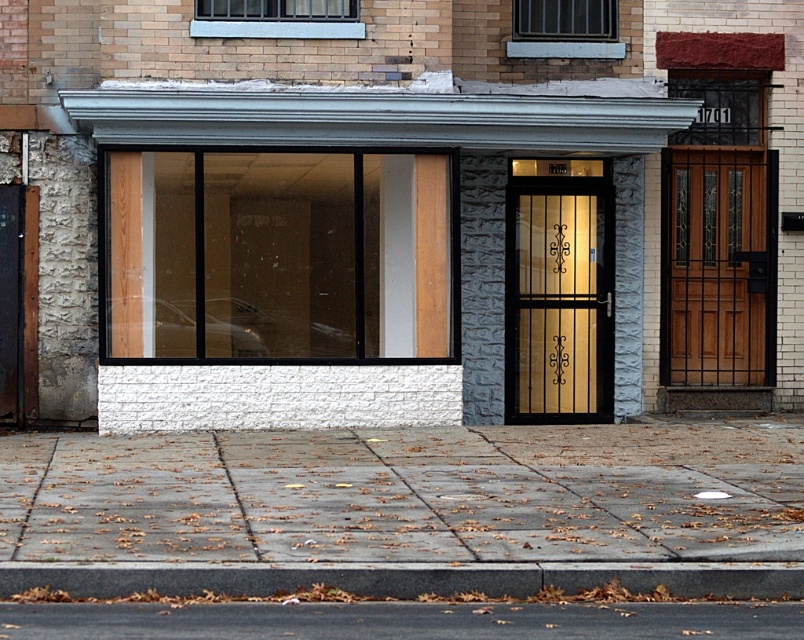
Question: Which object appears closest to the camera in this image?

Choices:
 (A) gray concrete pavement at lower center
 (B) white brick wall at center
 (C) mahogany wood door at right
 (D) gold textured glass door at center

Answer: (A)

Question: Which object is positioned farthest from the white brick wall at center?

Choices:
 (A) gray concrete pavement at lower center
 (B) gold textured glass door at center
 (C) mahogany wood door at right

Answer: (A)

Question: Among these points, which one is farthest from the camera?

Choices:
 (A) (314, 97)
 (B) (515, 372)
 (C) (759, 573)
 (D) (548, 557)

Answer: (B)

Question: Is white brick wall at center to the right of mahogany wood door at right from the viewer's perspective?

Choices:
 (A) no
 (B) yes

Answer: (A)

Question: Is mahogany wood door at right smaller than gray concrete curb at lower center?

Choices:
 (A) yes
 (B) no

Answer: (B)

Question: Is white brick wall at center below smooth asphalt road at lower center?

Choices:
 (A) yes
 (B) no

Answer: (B)